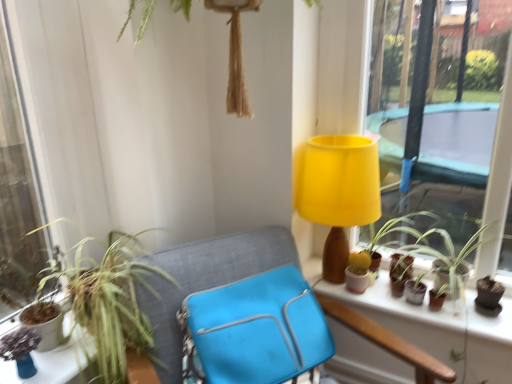
Question: Considering the relative sizes of matte green plant at lower left and blue fabric bag at center in the image provided, is matte green plant at lower left shorter than blue fabric bag at center?

Choices:
 (A) yes
 (B) no

Answer: (A)

Question: Considering the relative positions of matte green plant at lower left and blue fabric bag at center in the image provided, is matte green plant at lower left to the right of blue fabric bag at center from the viewer's perspective?

Choices:
 (A) yes
 (B) no

Answer: (B)

Question: Does matte green plant at lower left have a smaller size compared to blue fabric bag at center?

Choices:
 (A) yes
 (B) no

Answer: (A)

Question: Is matte green plant at lower left further to camera compared to blue fabric bag at center?

Choices:
 (A) yes
 (B) no

Answer: (A)

Question: Would you consider matte green plant at lower left to be distant from blue fabric bag at center?

Choices:
 (A) no
 (B) yes

Answer: (A)

Question: Considering the positions of matte brown flowerpot at right, which is the first flowerpot from right to left, and matte green plant at lower left in the image, is matte brown flowerpot at right, which is the first flowerpot from right to left, taller or shorter than matte green plant at lower left?

Choices:
 (A) short
 (B) tall

Answer: (B)

Question: Looking at their shapes, would you say matte brown flowerpot at right, the 2th flowerpot from the left, is wider or thinner than matte green plant at lower left?

Choices:
 (A) thin
 (B) wide

Answer: (A)

Question: Considering the relative positions of matte brown flowerpot at right, which is the first flowerpot from right to left, and matte green plant at lower left in the image provided, is matte brown flowerpot at right, which is the first flowerpot from right to left, to the left or to the right of matte green plant at lower left?

Choices:
 (A) left
 (B) right

Answer: (B)

Question: Is matte brown flowerpot at right, which is the first flowerpot from right to left, spatially inside matte green plant at lower left, or outside of it?

Choices:
 (A) inside
 (B) outside

Answer: (B)

Question: In terms of height, does matte brown flowerpot at right, the 2th flowerpot from the left, look taller or shorter compared to blue fabric bag at center?

Choices:
 (A) tall
 (B) short

Answer: (B)

Question: From the image's perspective, is matte brown flowerpot at right, the 2th flowerpot from the left, located above or below blue fabric bag at center?

Choices:
 (A) above
 (B) below

Answer: (A)

Question: From a real-world perspective, is matte brown flowerpot at right, which is the first flowerpot from right to left, physically located above or below blue fabric bag at center?

Choices:
 (A) above
 (B) below

Answer: (A)

Question: Is matte brown flowerpot at right, which is the first flowerpot from right to left, wider or thinner than blue fabric bag at center?

Choices:
 (A) thin
 (B) wide

Answer: (A)

Question: From the image's perspective, relative to matte brown flowerpot at right, which is the first flowerpot from right to left, is green leafy plant at left, placed as the 1th houseplant when sorted from left to right, above or below?

Choices:
 (A) above
 (B) below

Answer: (B)

Question: From a real-world perspective, is green leafy plant at left, which is the second houseplant from right to left, positioned above or below matte brown flowerpot at right, which is the first flowerpot from right to left?

Choices:
 (A) above
 (B) below

Answer: (A)